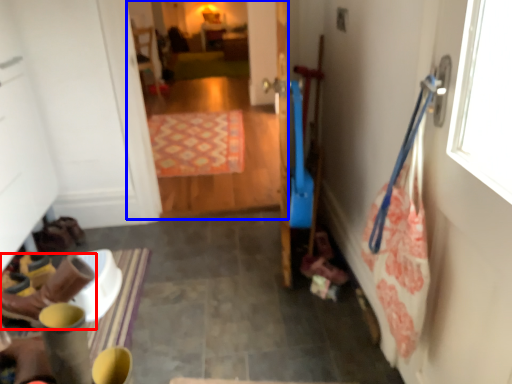
Question: Which object appears farthest to the camera in this image, footwear (highlighted by a red box) or corridor (highlighted by a blue box)?

Choices:
 (A) footwear
 (B) corridor

Answer: (B)